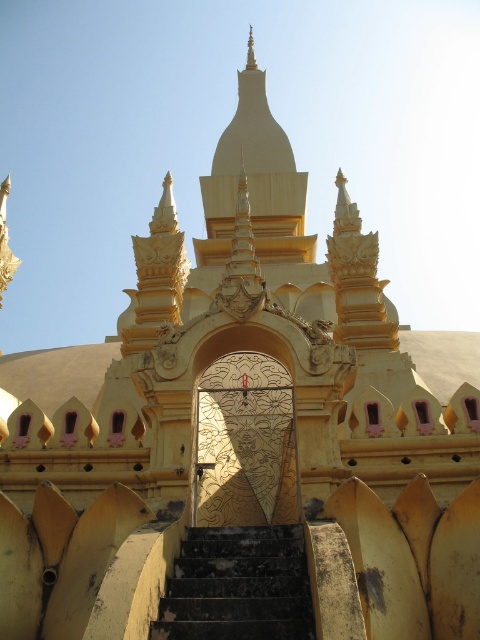
The height and width of the screenshot is (640, 480). What do you see at coordinates (244, 444) in the screenshot? I see `gold textured door at center` at bounding box center [244, 444].

Looking at this image, can you confirm if gold textured door at center is shorter than black stone stairs at center?

Incorrect, gold textured door at center's height does not fall short of black stone stairs at center's.

Who is more forward, (242, 492) or (196, 544)?

Point (196, 544)

I want to click on gold textured door at center, so click(x=244, y=444).